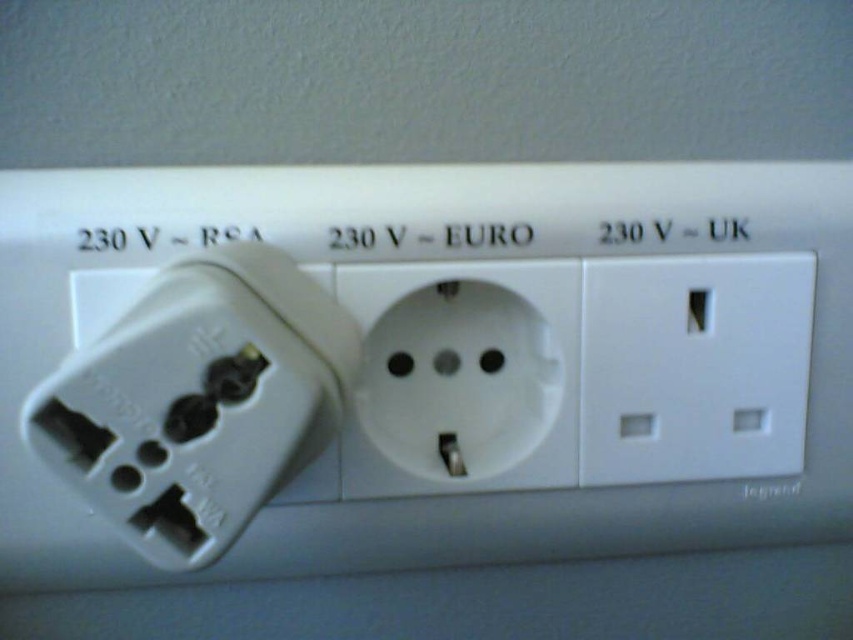
What do you see at coordinates (198, 401) in the screenshot? This screenshot has width=853, height=640. I see `white plastic plug at center` at bounding box center [198, 401].

Does white plastic plug at center appear over white plastic socket at right?

Yes.

Where is `white plastic plug at center`? white plastic plug at center is located at coordinates 198,401.

Does point (560, 394) come closer to viewer compared to point (724, 372)?

Yes, point (560, 394) is in front of point (724, 372).

Who is more distant from viewer, (544, 339) or (665, 442)?

The point (665, 442) is behind.

Does point (456, 317) lie in front of point (689, 333)?

No, it is not.

The height and width of the screenshot is (640, 853). Identify the location of white plastic socket at center. (463, 376).

Does white plastic plug at center have a lesser width compared to white plastic socket at center?

No, white plastic plug at center is not thinner than white plastic socket at center.

Can you confirm if white plastic plug at center is taller than white plastic socket at center?

Yes.

Find the location of a particular element. white plastic plug at center is located at coordinates (198, 401).